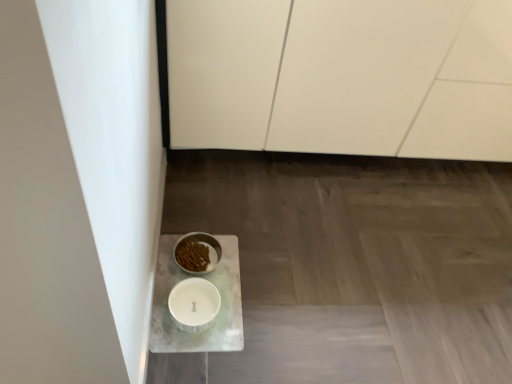
What are the coordinates of `vacant area located to the right-hand side of white marble tray at lower left` in the screenshot? It's located at (288, 298).